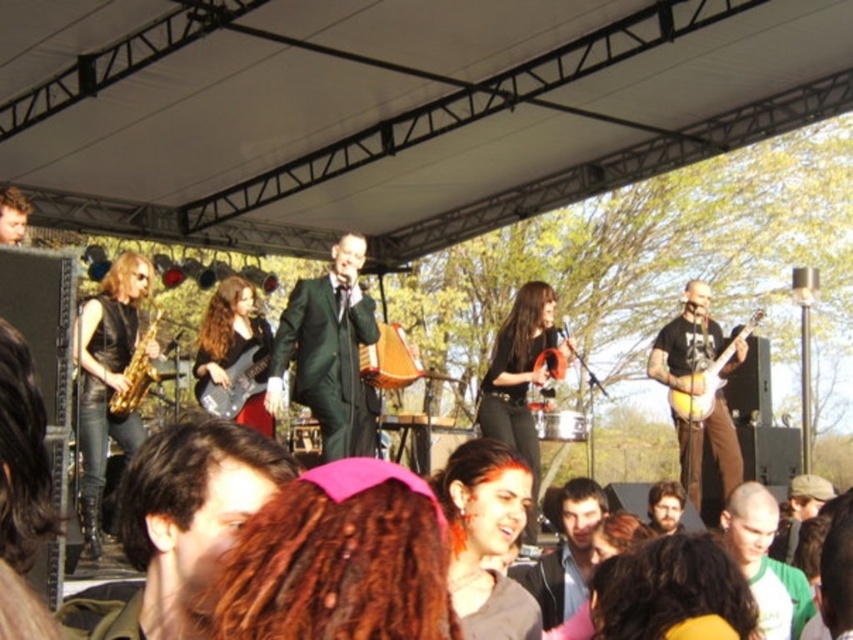
You are a photographer at the concert and want to capture a clear photo of both the shiny black suit at center and the smooth brown hair at center. Which object should you focus on first to ensure both are in focus?

The shiny black suit at center is much taller than the smooth brown hair at center, so focusing on the shiny black suit at center first will ensure both are in focus since it is farther away.

You are a photographer at the concert and want to capture a closeup shot of the shiny black suit at center and the smooth brown hair at center. Since you can only focus on one object clearly, which one should you choose to ensure it takes up more of the frame?

The smooth brown hair at center occupies more space than the shiny black suit at center, so you should focus on the smooth brown hair at center to ensure it takes up more of the frame.

You are standing in the audience at the live outdoor concert. You notice two points marked in the image. The first point is at coordinate [735,525] and the second point is at coordinate [567,340]. Which point is closer to you?

Point [735,525] is closer to the viewer than point [567,340].